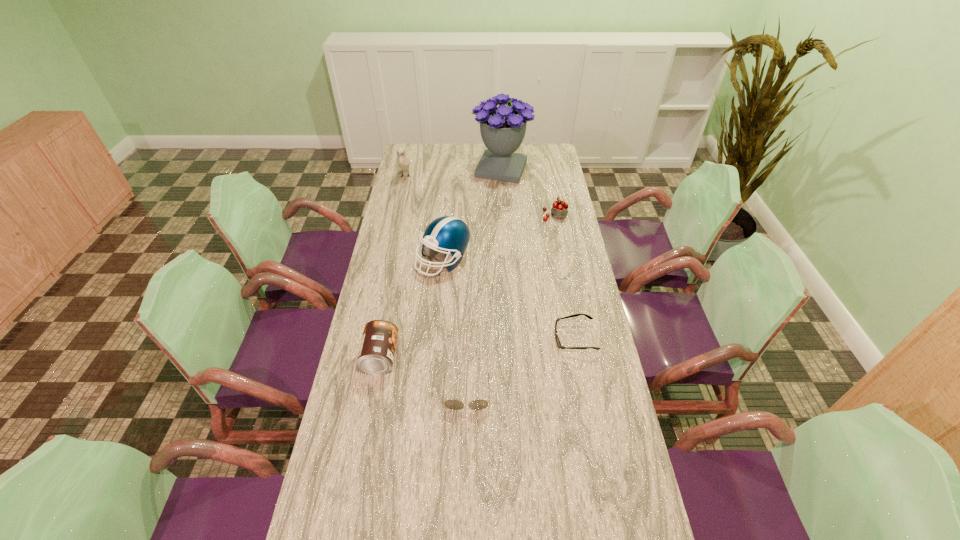
Select which object appears as the fifth closest to the bird. Please provide its 2D coordinates. Your answer should be formatted as a tuple, i.e. [(x, y)], where the tuple contains the x and y coordinates of a point satisfying the conditions above.

[(558, 342)]

Choose which object is the second nearest neighbor to the bouquet. Please provide its 2D coordinates. Your answer should be formatted as a tuple, i.e. [(x, y)], where the tuple contains the x and y coordinates of a point satisfying the conditions above.

[(403, 162)]